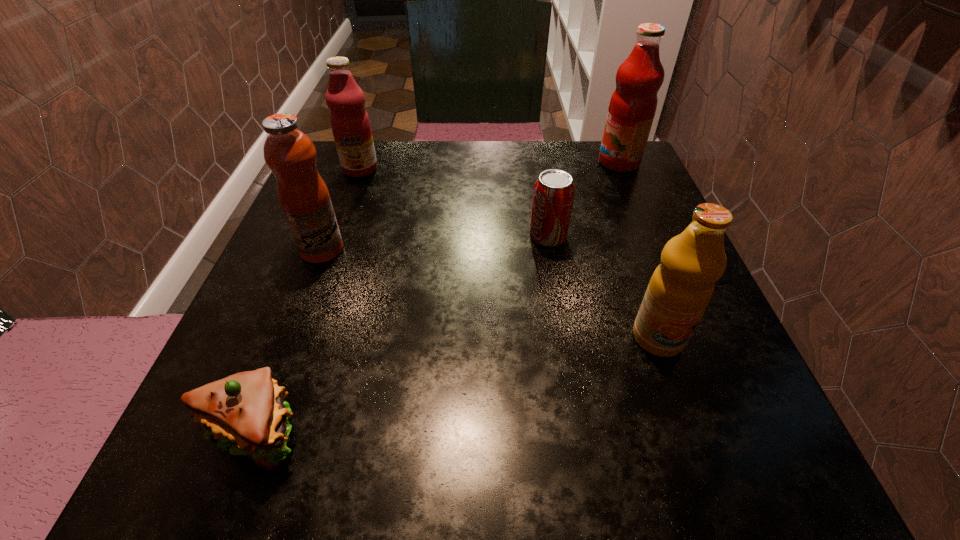
Find the location of a particular element. The width and height of the screenshot is (960, 540). object that is at the far left corner is located at coordinates (350, 123).

Locate an element on the screen. This screenshot has width=960, height=540. object located at the near left corner is located at coordinates (246, 411).

Image resolution: width=960 pixels, height=540 pixels. Identify the location of object that is at the far right corner. (632, 107).

This screenshot has width=960, height=540. In order to click on free region at the far edge in this screenshot , I will do `click(406, 148)`.

Where is `free space at the near edge of the desktop`? free space at the near edge of the desktop is located at coordinates (660, 488).

In the image, there is a desktop. Where is `vacant space at the left edge`? The image size is (960, 540). vacant space at the left edge is located at coordinates (338, 333).

Find the location of a particular element. Image resolution: width=960 pixels, height=540 pixels. vacant space at the right edge is located at coordinates (655, 369).

Identify the location of vacant space at the near right corner of the desktop. The height and width of the screenshot is (540, 960). (786, 468).

You are a GUI agent. You are given a task and a screenshot of the screen. Output one action in this format:
    pyautogui.click(x=<x>, y=<y>)
    Task: Click on the free space between the third object from right to left and the third farthest fruit juice
    The height and width of the screenshot is (540, 960).
    Given the screenshot: What is the action you would take?
    (435, 243)

Image resolution: width=960 pixels, height=540 pixels. Find the location of `free space that is in between the nearest fruit juice and the sandwich`. free space that is in between the nearest fruit juice and the sandwich is located at coordinates (456, 385).